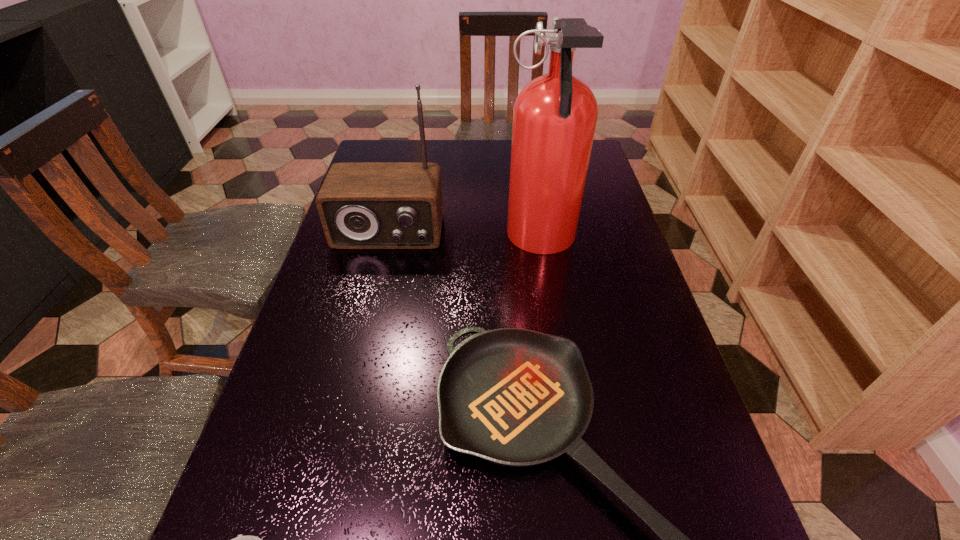
At what (x,y) coordinates should I click in order to perform the action: click on fire extinguisher. Please return your answer as a coordinate pair (x, y). The width and height of the screenshot is (960, 540). Looking at the image, I should click on (554, 116).

Find the location of a particular element. The width and height of the screenshot is (960, 540). radio receiver is located at coordinates (362, 205).

You are a GUI agent. You are given a task and a screenshot of the screen. Output one action in this format:
    pyautogui.click(x=<x>, y=<y>)
    Task: Click on the free location located 0.160m on the back of the fire extinguisher
    
    Given the screenshot: What is the action you would take?
    pyautogui.click(x=531, y=178)

Locate an element on the screen. The height and width of the screenshot is (540, 960). free space located on the front-facing side of the third shortest object is located at coordinates (355, 372).

This screenshot has height=540, width=960. I want to click on object that is at the left edge, so click(x=362, y=205).

At what (x,y) coordinates should I click in order to perform the action: click on object located in the right edge section of the desktop. Please return your answer as a coordinate pair (x, y). The width and height of the screenshot is (960, 540). Looking at the image, I should click on (554, 116).

In the image, there is a desktop. Where is `vacant region at the far edge`? The height and width of the screenshot is (540, 960). vacant region at the far edge is located at coordinates (458, 171).

Locate an element on the screen. The height and width of the screenshot is (540, 960). vacant space at the left edge of the desktop is located at coordinates (288, 392).

Find the location of `free space at the right edge of the desktop`. free space at the right edge of the desktop is located at coordinates (614, 242).

In order to click on empty space that is in between the radio receiver and the tallest object in this screenshot , I will do `click(465, 237)`.